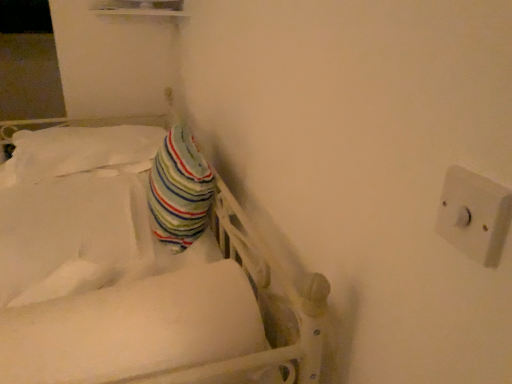
The height and width of the screenshot is (384, 512). What do you see at coordinates (133, 328) in the screenshot?
I see `white soft mattress at center` at bounding box center [133, 328].

The height and width of the screenshot is (384, 512). Describe the element at coordinates (474, 215) in the screenshot. I see `white plastic switch at upper right` at that location.

Locate an element on the screen. striped fabric pillow at center is located at coordinates (179, 190).

What do you see at coordinates (81, 149) in the screenshot?
I see `striped fabric pillow at upper left` at bounding box center [81, 149].

What are the coordinates of `white soft mattress at center` in the screenshot? It's located at (133, 328).

Is point (54, 132) in front of point (490, 208)?

No, it is not.

Do you think striped fabric pillow at upper left is within white plastic switch at upper right, or outside of it?

striped fabric pillow at upper left exists outside the volume of white plastic switch at upper right.

Is striped fabric pillow at upper left facing away from white plastic switch at upper right?

No, striped fabric pillow at upper left is not facing the opposite direction of white plastic switch at upper right.

Does striped fabric pillow at center have a lesser width compared to striped fabric pillow at upper left?

Correct, the width of striped fabric pillow at center is less than that of striped fabric pillow at upper left.

Considering the relative positions of striped fabric pillow at center and striped fabric pillow at upper left in the image provided, is striped fabric pillow at center to the right of striped fabric pillow at upper left from the viewer's perspective?

Correct, you'll find striped fabric pillow at center to the right of striped fabric pillow at upper left.

Locate an element on the screen. throw pillow on the right of striped fabric pillow at upper left is located at coordinates (179, 190).

From a real-world perspective, is striped fabric pillow at center over striped fabric pillow at upper left?

Yes, from a real-world perspective, striped fabric pillow at center is above striped fabric pillow at upper left.

Are striped fabric pillow at center and white soft mattress at center far apart?

That's not correct — striped fabric pillow at center is a little close to white soft mattress at center.

Looking at the image, does striped fabric pillow at center seem bigger or smaller compared to white soft mattress at center?

striped fabric pillow at center is bigger than white soft mattress at center.

Consider the image. From a real-world perspective, is striped fabric pillow at center positioned under white soft mattress at center based on gravity?

No, from a real-world perspective, striped fabric pillow at center is not below white soft mattress at center.

Consider the image. From a real-world perspective, is striped fabric pillow at upper left positioned above or below striped fabric pillow at center?

striped fabric pillow at upper left is situated lower than striped fabric pillow at center in the real world.

Considering the sizes of striped fabric pillow at upper left and striped fabric pillow at center in the image, is striped fabric pillow at upper left bigger or smaller than striped fabric pillow at center?

Clearly, striped fabric pillow at upper left is larger in size than striped fabric pillow at center.

Would you say striped fabric pillow at center is part of striped fabric pillow at upper left's contents?

No, striped fabric pillow at center is not inside striped fabric pillow at upper left.

Considering the points (150, 130) and (190, 176), which point is in front, point (150, 130) or point (190, 176)?

Point (190, 176)

Between striped fabric pillow at center and white plastic switch at upper right, which one has larger size?

Bigger between the two is striped fabric pillow at center.

Can you confirm if striped fabric pillow at center is shorter than white plastic switch at upper right?

No, striped fabric pillow at center is not shorter than white plastic switch at upper right.

Is striped fabric pillow at center at the right side of white plastic switch at upper right?

In fact, striped fabric pillow at center is to the left of white plastic switch at upper right.

Could you tell me if striped fabric pillow at center is facing white plastic switch at upper right?

No, striped fabric pillow at center does not turn towards white plastic switch at upper right.

Considering the sizes of objects white soft mattress at center and white plastic switch at upper right in the image provided, who is shorter, white soft mattress at center or white plastic switch at upper right?

white plastic switch at upper right is shorter.

Are white soft mattress at center and white plastic switch at upper right located far from each other?

No, there isn't a large distance between white soft mattress at center and white plastic switch at upper right.

Does white soft mattress at center appear on the right side of white plastic switch at upper right?

In fact, white soft mattress at center is to the left of white plastic switch at upper right.

From the image's perspective, who appears lower, white soft mattress at center or white plastic switch at upper right?

white soft mattress at center.

Can you tell me how much white soft mattress at center and striped fabric pillow at upper left differ in facing direction?

The angular difference between white soft mattress at center and striped fabric pillow at upper left is 0.000323 degrees.

Would you say white soft mattress at center is to the left or to the right of striped fabric pillow at upper left in the picture?

From the image, it's evident that white soft mattress at center is to the right of striped fabric pillow at upper left.

Does white soft mattress at center have a lesser width compared to striped fabric pillow at upper left?

Correct, the width of white soft mattress at center is less than that of striped fabric pillow at upper left.

Between white soft mattress at center and striped fabric pillow at upper left, which one has smaller size?

Smaller between the two is white soft mattress at center.

You are a GUI agent. You are given a task and a screenshot of the screen. Output one action in this format:
    pyautogui.click(x=<x>, y=<y>)
    Task: Click on the pillow behind the white plastic switch at upper right
    Image resolution: width=512 pixels, height=384 pixels.
    Given the screenshot: What is the action you would take?
    pyautogui.click(x=81, y=149)

This screenshot has width=512, height=384. What are the coordinates of `pillow on the left side of striped fabric pillow at center` in the screenshot? It's located at (81, 149).

Which object lies further to the anchor point striped fabric pillow at center, white soft mattress at center or striped fabric pillow at upper left?

The object further to striped fabric pillow at center is striped fabric pillow at upper left.

Estimate the real-world distances between objects in this image. Which object is closer to white soft mattress at center, striped fabric pillow at upper left or white plastic switch at upper right?

white plastic switch at upper right is positioned closer to the anchor white soft mattress at center.

Considering their positions, is striped fabric pillow at center positioned further to white soft mattress at center than striped fabric pillow at upper left?

striped fabric pillow at upper left lies further to white soft mattress at center than the other object.

From the image, which object appears to be farther from striped fabric pillow at center, white plastic switch at upper right or striped fabric pillow at upper left?

Based on the image, white plastic switch at upper right appears to be further to striped fabric pillow at center.

Which object lies further to the anchor point white soft mattress at center, striped fabric pillow at upper left or striped fabric pillow at center?

striped fabric pillow at upper left is further to white soft mattress at center.

From the image, which object appears to be nearer to white plastic switch at upper right, striped fabric pillow at upper left or white soft mattress at center?

white soft mattress at center lies closer to white plastic switch at upper right than the other object.

When comparing their distances from white soft mattress at center, does striped fabric pillow at center or white plastic switch at upper right seem further?

striped fabric pillow at center.

Which object lies nearer to the anchor point striped fabric pillow at upper left, white plastic switch at upper right or white soft mattress at center?

Based on the image, white soft mattress at center appears to be nearer to striped fabric pillow at upper left.

Identify the location of mattress between white plastic switch at upper right and striped fabric pillow at center along the z-axis. The height and width of the screenshot is (384, 512). (133, 328).

I want to click on throw pillow between white plastic switch at upper right and striped fabric pillow at upper left from front to back, so click(179, 190).

The height and width of the screenshot is (384, 512). In order to click on mattress between white plastic switch at upper right and striped fabric pillow at upper left from front to back in this screenshot , I will do `click(133, 328)`.

Where is `throw pillow between white soft mattress at center and striped fabric pillow at upper left along the z-axis`? throw pillow between white soft mattress at center and striped fabric pillow at upper left along the z-axis is located at coordinates (179, 190).